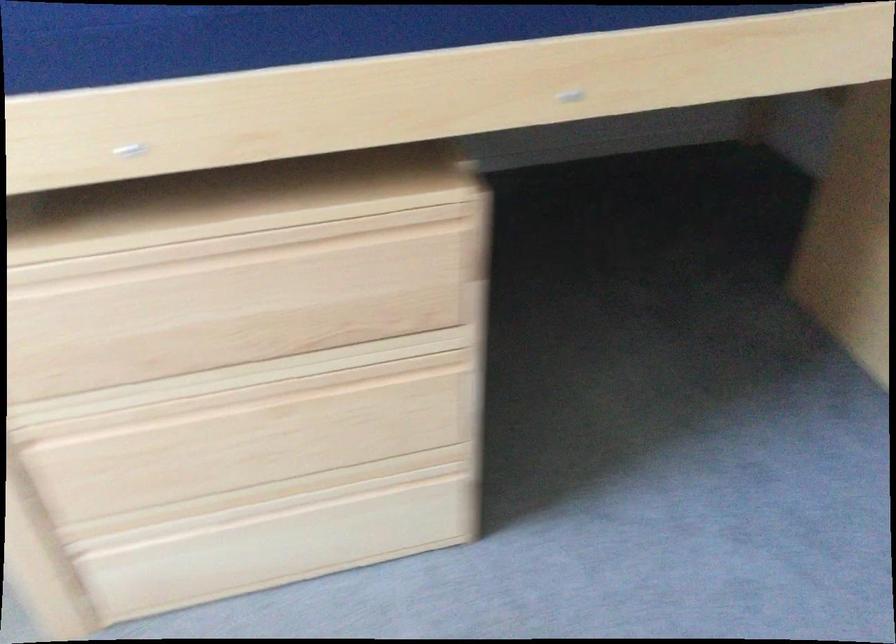
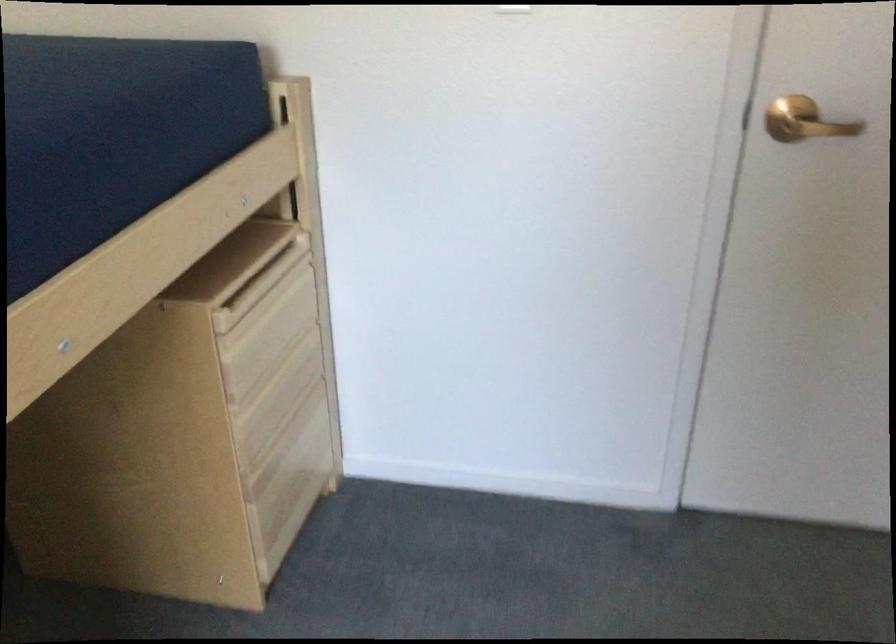
Question: The camera is either moving clockwise (left) or counter-clockwise (right) around the object. The first image is from the beginning of the video and the second image is from the end. Is the camera moving left or right when shooting the video?

Choices:
 (A) Left
 (B) Right

Answer: (A)